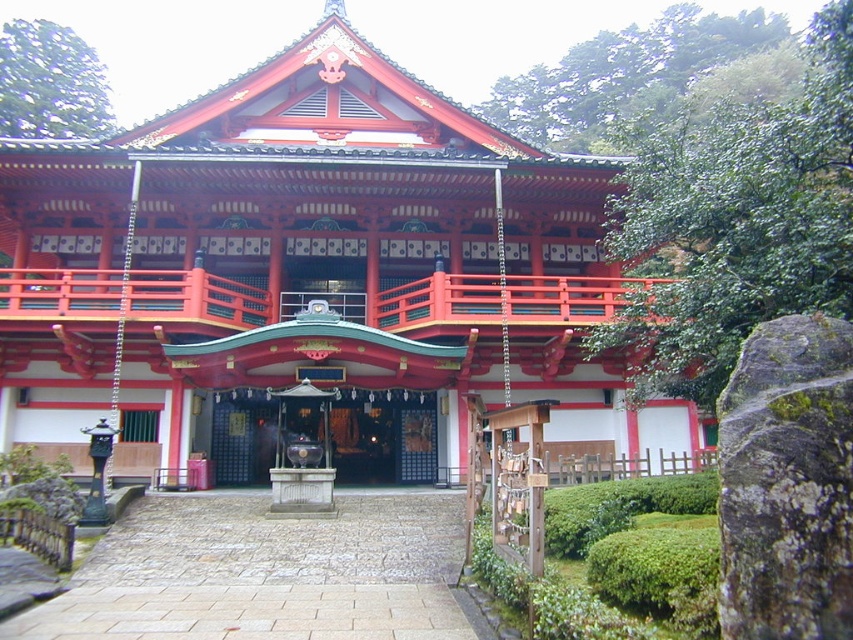
You are a visitor standing in front of the temple and want to place a small offering on the smooth stone altar at center. Can you place it directly in front of the shiny red wood temple at center without moving the altar?

The shiny red wood temple at center is positioned over smooth stone altar at center, so you cannot place the offering directly in front of the temple without moving the altar because the altar is already beneath the temple.

You are a visitor standing in front of the temple and want to take a photo that includes both the shiny red wood temple at center and the smooth stone altar at center. Which object should you focus on first to ensure both are in frame?

You should focus on the shiny red wood temple at center first because it is taller than the smooth stone altar at center, so adjusting your camera angle to include its full height will naturally include the shorter altar in the frame as well.

You are a visitor standing in front of the temple and want to place a small offering on the smooth stone altar at center. Given that the shiny red wood temple at center is in the way, can you still access the altar easily?

The shiny red wood temple at center is wider than the smooth stone altar at center, so you can still access the altar easily because the temple is not blocking the entire area.